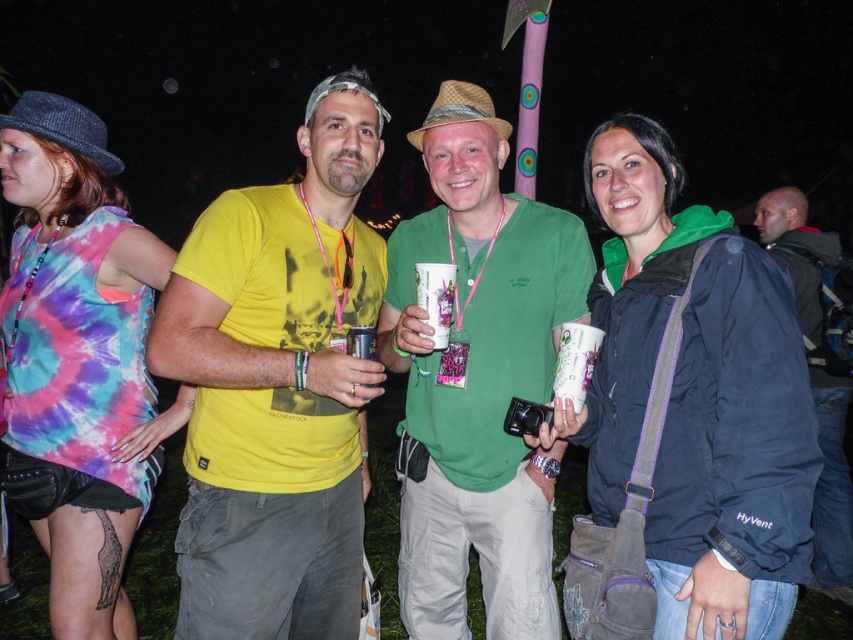
Question: Does hyvent blue jacket at right appear on the right side of dark blue jacket at right?

Choices:
 (A) yes
 (B) no

Answer: (B)

Question: Is matte yellow t-shirt at center smaller than dark blue jacket at right?

Choices:
 (A) yes
 (B) no

Answer: (A)

Question: Which point is closer to the camera?

Choices:
 (A) matte yellow t-shirt at center
 (B) dark blue jacket at right

Answer: (A)

Question: Is green matte shirt at center to the left of dark blue jacket at right from the viewer's perspective?

Choices:
 (A) no
 (B) yes

Answer: (B)

Question: Which is nearer to the hyvent blue jacket at right?

Choices:
 (A) matte yellow t-shirt at center
 (B) dark blue jacket at right

Answer: (A)

Question: Which of these objects is positioned closest to the dark blue jacket at right?

Choices:
 (A) matte yellow t-shirt at center
 (B) hyvent blue jacket at right
 (C) green matte shirt at center

Answer: (C)